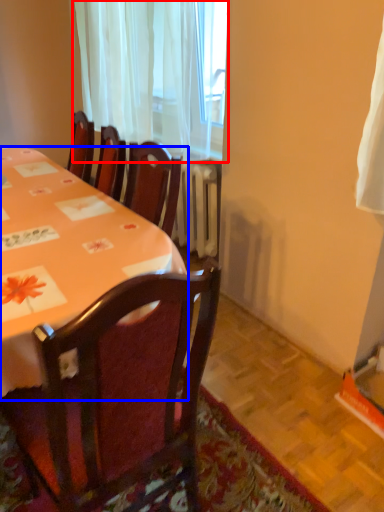
Question: Which point is closer to the camera, curtain (highlighted by a red box) or desk (highlighted by a blue box)?

Choices:
 (A) curtain
 (B) desk

Answer: (B)